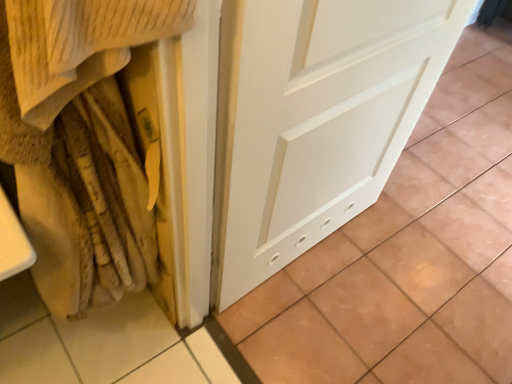
What do you see at coordinates (86, 171) in the screenshot? I see `beige textured blanket at left` at bounding box center [86, 171].

Identify the location of beige textured blanket at left. This screenshot has height=384, width=512. (86, 171).

Describe the element at coordinates (314, 120) in the screenshot. I see `white matte door at center` at that location.

In the scene shown: In order to face white matte door at center, should I rotate leftwards or rightwards?

You should rotate right by 27.667 degrees.

You are a GUI agent. You are given a task and a screenshot of the screen. Output one action in this format:
    pyautogui.click(x=<x>, y=<y>)
    Task: Click on the white matte door at center
    The image size is (512, 384).
    Given the screenshot: What is the action you would take?
    pyautogui.click(x=314, y=120)

Find the location of a particular element. This screenshot has width=512, height=384. beige textured blanket at left is located at coordinates (86, 171).

Which is more to the right, white matte door at center or beige textured blanket at left?

white matte door at center is more to the right.

Is white matte door at center positioned behind beige textured blanket at left?

Yes, white matte door at center is behind beige textured blanket at left.

Does point (283, 202) come farther from viewer compared to point (159, 142)?

Yes.

From the image's perspective, who appears lower, white matte door at center or beige textured blanket at left?

From the image's view, beige textured blanket at left is below.

From a real-world perspective, which is physically above, white matte door at center or beige textured blanket at left?

beige textured blanket at left is physically above.

Which of these two, white matte door at center or beige textured blanket at left, is thinner?

beige textured blanket at left.

Is white matte door at center taller than beige textured blanket at left?

No, white matte door at center is not taller than beige textured blanket at left.

Considering the sizes of objects white matte door at center and beige textured blanket at left in the image provided, who is bigger, white matte door at center or beige textured blanket at left?

With larger size is white matte door at center.

From the picture: Is beige textured blanket at left surrounded by white matte door at center?

No, beige textured blanket at left is not a part of white matte door at center.

Are white matte door at center and beige textured blanket at left located far from each other?

No, there isn't a large distance between white matte door at center and beige textured blanket at left.

Could you tell me if white matte door at center is facing beige textured blanket at left?

No, white matte door at center is not facing towards beige textured blanket at left.

Can you tell me how much white matte door at center and beige textured blanket at left differ in facing direction?

They differ by 4.61e-05 degrees in their facing directions.

Where is `door below the beige textured blanket at left (from a real-world perspective)`? Image resolution: width=512 pixels, height=384 pixels. door below the beige textured blanket at left (from a real-world perspective) is located at coordinates (314, 120).

Is beige textured blanket at left at the right side of white matte door at center?

In fact, beige textured blanket at left is to the left of white matte door at center.

Is beige textured blanket at left further to camera compared to white matte door at center?

No, beige textured blanket at left is closer to the camera.

Does point (58, 190) appear closer or farther from the camera than point (219, 307)?

Point (58, 190) appears to be closer to the viewer than point (219, 307).

From the image's perspective, which is below, beige textured blanket at left or white matte door at center?

beige textured blanket at left is shown below in the image.

From a real-world perspective, which is physically above, beige textured blanket at left or white matte door at center?

beige textured blanket at left, from a real-world perspective.

In terms of width, does beige textured blanket at left look wider or thinner when compared to white matte door at center?

beige textured blanket at left is thinner than white matte door at center.

Which of these two, beige textured blanket at left or white matte door at center, stands shorter?

white matte door at center.

Who is bigger, beige textured blanket at left or white matte door at center?

Bigger between the two is white matte door at center.

Is beige textured blanket at left surrounding white matte door at center?

Definitely not — white matte door at center is not inside beige textured blanket at left.

Consider the image. Does beige textured blanket at left touch white matte door at center?

beige textured blanket at left is not next to white matte door at center, and they're not touching.

Is beige textured blanket at left oriented away from white matte door at center?

Yes, beige textured blanket at left is positioned with its back facing white matte door at center.

Can you tell me how much beige textured blanket at left and white matte door at center differ in facing direction?

4.61e-05 degrees separate the facing orientations of beige textured blanket at left and white matte door at center.

Measure the distance between beige textured blanket at left and white matte door at center.

beige textured blanket at left is 13.76 inches away from white matte door at center.

Locate an element on the screen. door directly beneath the beige textured blanket at left (from a real-world perspective) is located at coordinates (314, 120).

The width and height of the screenshot is (512, 384). I want to click on blanket above the white matte door at center (from a real-world perspective), so click(86, 171).

This screenshot has width=512, height=384. What are the coordinates of `blanket lying on the left of white matte door at center` in the screenshot? It's located at (86, 171).